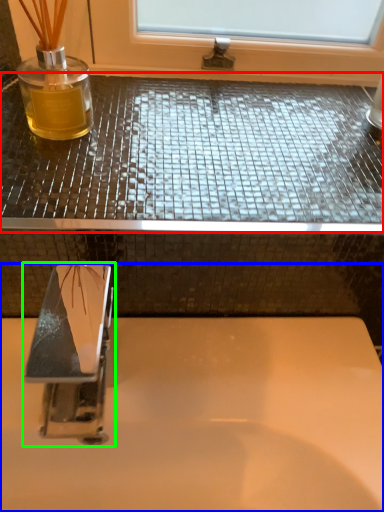
Question: Considering the real-world distances, which object is closest to counter top (highlighted by a red box)? sink (highlighted by a blue box) or tap (highlighted by a green box).

Choices:
 (A) sink
 (B) tap

Answer: (A)